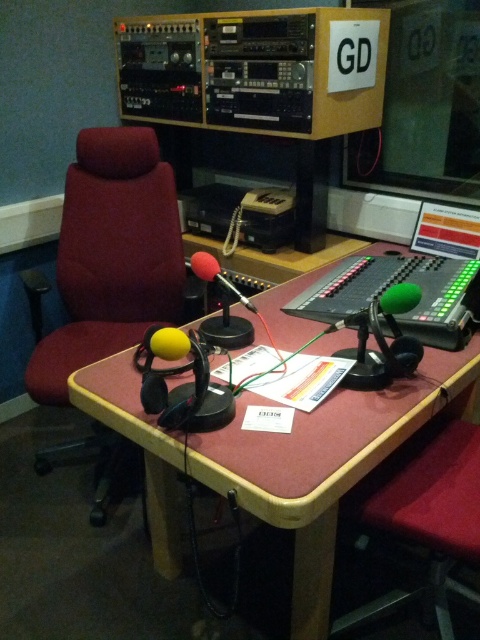
Question: Is velvet red swivel chair at left below wooden desk at center?

Choices:
 (A) no
 (B) yes

Answer: (A)

Question: Which point appears closest to the camera in this image?

Choices:
 (A) (191, 262)
 (B) (253, 502)
 (C) (126, 228)

Answer: (B)

Question: Considering the relative positions of velvet red swivel chair at left and rubberized red microphone at center in the image provided, where is velvet red swivel chair at left located with respect to rubberized red microphone at center?

Choices:
 (A) above
 (B) below

Answer: (A)

Question: Which object is positioned farthest from the rubberized red microphone at center?

Choices:
 (A) wooden desk at center
 (B) velvet red swivel chair at left

Answer: (B)

Question: Can you confirm if velvet red swivel chair at left is bigger than wooden desk at center?

Choices:
 (A) yes
 (B) no

Answer: (B)

Question: Which of the following is the farthest from the observer?

Choices:
 (A) velvet red swivel chair at left
 (B) wooden desk at center
 (C) rubberized red microphone at center

Answer: (A)